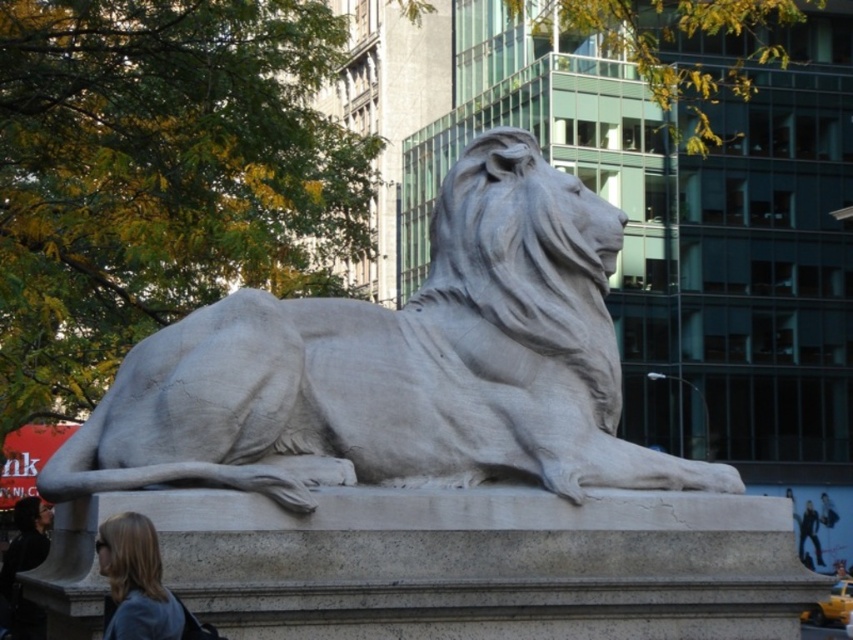
You are standing in front of the white stone lion at center and want to take a photo of the blonde hair at lower left without the lion blocking the view. Is this possible?

The white stone lion at center is further to the viewer than the blonde hair at lower left. Therefore, the lion will block the view of the blonde hair at lower left, making it impossible to take a photo without obstruction.

You are a photographer trying to capture the white stone lion at center and the blonde hair at lower left in the same frame. Based on their sizes, which object should you focus on to ensure both are visible without zooming in or out?

The white stone lion at center is larger than the blonde hair at lower left, so you should focus on the white stone lion at center to ensure both are visible without adjusting the zoom.